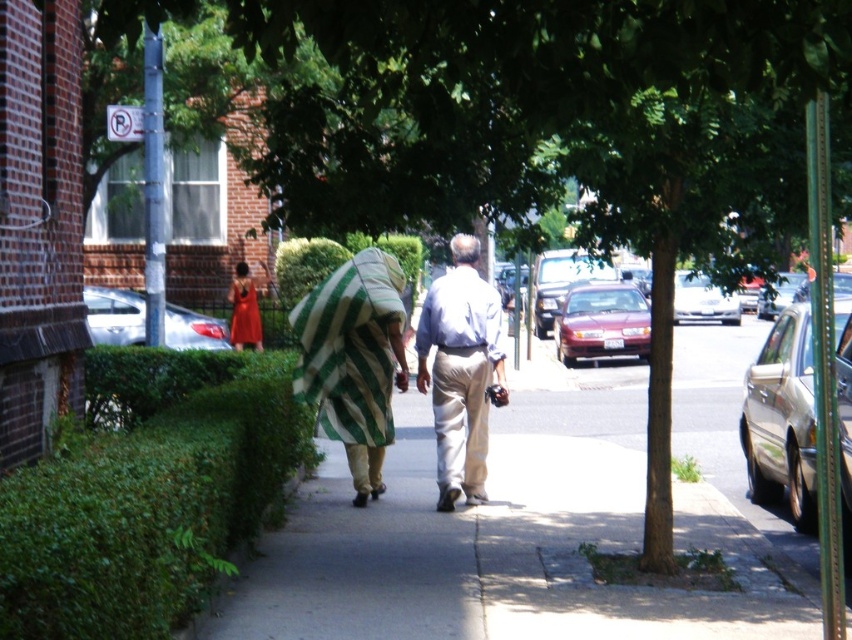
You are a pedestrian standing on the sidewalk. You see the silver metallic sedan at center and the metallic silver sedan at center right. Which one is closer to the ground?

The silver metallic sedan at center is closer to the ground because it is positioned below the metallic silver sedan at center right.

What are the coordinates of the silver metallic sedan at center?

The silver metallic sedan at center is located at coordinates point (701, 300).

You are a photographer trying to capture a photo of both the shiny orange dress at center and the metallic silver sedan at center right. However, you notice that one of them is significantly taller than the other. Which object should you adjust your camera angle to focus on to ensure both are fully visible in the frame?

The shiny orange dress at center is much taller than the metallic silver sedan at center right. To ensure both are fully visible, adjust your camera angle to focus on the shiny orange dress at center since it is taller and requires more vertical space in the frame.